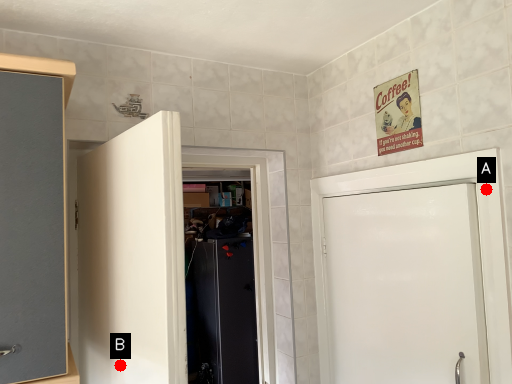
Question: Two points are circled on the image, labeled by A and B beside each circle. Which point appears farthest from the camera in this image?

Choices:
 (A) A is further
 (B) B is further

Answer: (B)